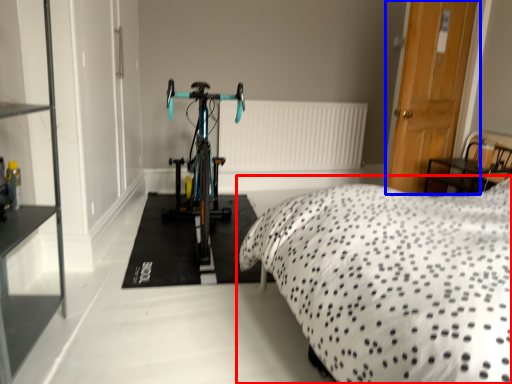
Question: Which of the following is the farthest to the observer, bed (highlighted by a red box) or door (highlighted by a blue box)?

Choices:
 (A) bed
 (B) door

Answer: (B)